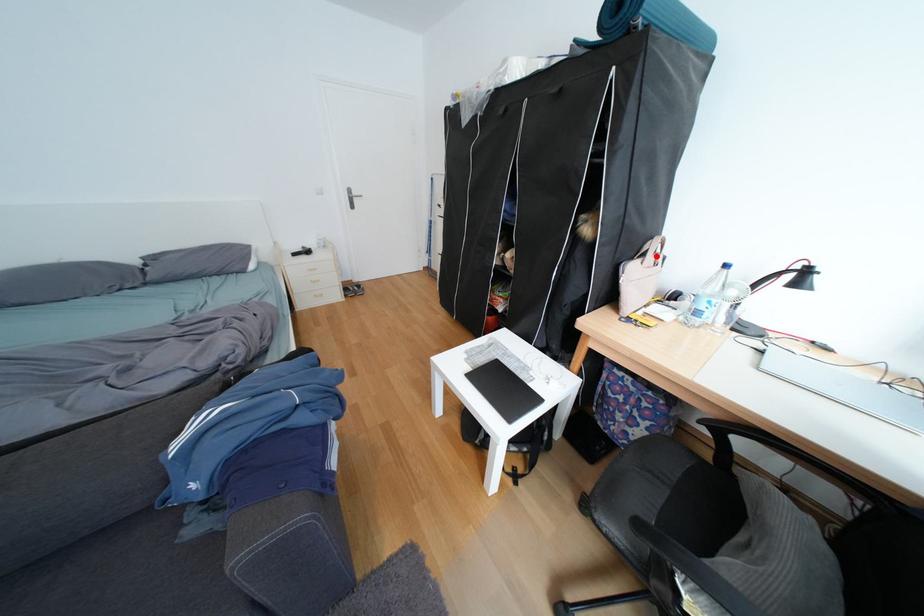
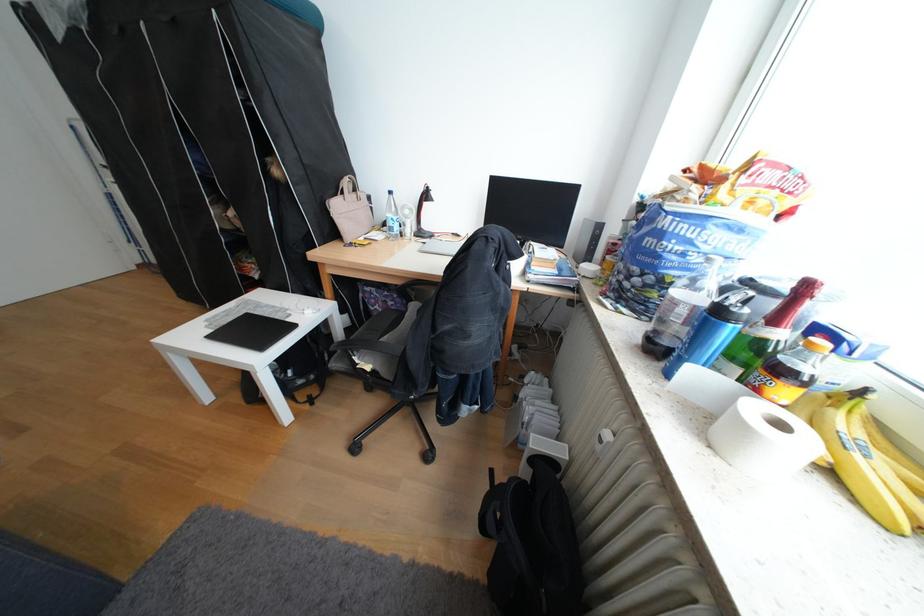
Question: I am providing you with two images of the same scene from different viewpoints. Image1 has a red point marked. In image2, the corresponding 3D location appears at what relative position? Reply with the corresponding letter.

Choices:
 (A) Closer
 (B) Farther

Answer: (A)